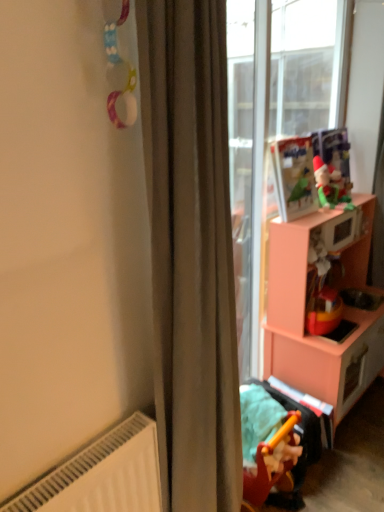
Question: Is yellow plastic toy at lower right, the 2th toy in the back-to-front sequence, to the left of pink matte cabinet at right from the viewer's perspective?

Choices:
 (A) yes
 (B) no

Answer: (A)

Question: Could you tell me if yellow plastic toy at lower right, marked as the first toy in a left-to-right arrangement, is turned towards pink matte cabinet at right?

Choices:
 (A) yes
 (B) no

Answer: (B)

Question: Is pink matte cabinet at right surrounded by yellow plastic toy at lower right, marked as the first toy in a left-to-right arrangement?

Choices:
 (A) yes
 (B) no

Answer: (B)

Question: Does yellow plastic toy at lower right, which ranks as the 1th toy in bottom-to-top order, have a larger size compared to pink matte cabinet at right?

Choices:
 (A) yes
 (B) no

Answer: (B)

Question: Does yellow plastic toy at lower right, which is the second toy in right-to-left order, appear on the right side of pink matte cabinet at right?

Choices:
 (A) no
 (B) yes

Answer: (A)

Question: From the image's perspective, is satin beige curtain at center above or below matte plastic toy at upper right, the 2th toy viewed from the left?

Choices:
 (A) above
 (B) below

Answer: (B)

Question: Considering the positions of satin beige curtain at center and matte plastic toy at upper right, acting as the 1th toy starting from the back, in the image, is satin beige curtain at center taller or shorter than matte plastic toy at upper right, acting as the 1th toy starting from the back,?

Choices:
 (A) short
 (B) tall

Answer: (B)

Question: From a real-world perspective, relative to matte plastic toy at upper right, which ranks as the first toy in top-to-bottom order, is satin beige curtain at center vertically above or below?

Choices:
 (A) below
 (B) above

Answer: (A)

Question: In the image, is satin beige curtain at center positioned in front of or behind matte plastic toy at upper right, the 2th toy viewed from the left?

Choices:
 (A) front
 (B) behind

Answer: (A)

Question: Does point (349, 390) appear closer or farther from the camera than point (163, 303)?

Choices:
 (A) farther
 (B) closer

Answer: (A)

Question: Is pink matte cabinet at right to the left or to the right of satin beige curtain at center in the image?

Choices:
 (A) left
 (B) right

Answer: (B)

Question: From the image's perspective, is pink matte cabinet at right positioned above or below satin beige curtain at center?

Choices:
 (A) below
 (B) above

Answer: (A)

Question: Considering the positions of pink matte cabinet at right and satin beige curtain at center in the image, is pink matte cabinet at right wider or thinner than satin beige curtain at center?

Choices:
 (A) wide
 (B) thin

Answer: (A)

Question: In the image, is yellow plastic toy at lower right, marked as the second toy in a top-to-bottom arrangement, on the left side or the right side of pink matte cabinet at right?

Choices:
 (A) left
 (B) right

Answer: (A)

Question: From a real-world perspective, is yellow plastic toy at lower right, which is the second toy in right-to-left order, positioned above or below pink matte cabinet at right?

Choices:
 (A) below
 (B) above

Answer: (A)